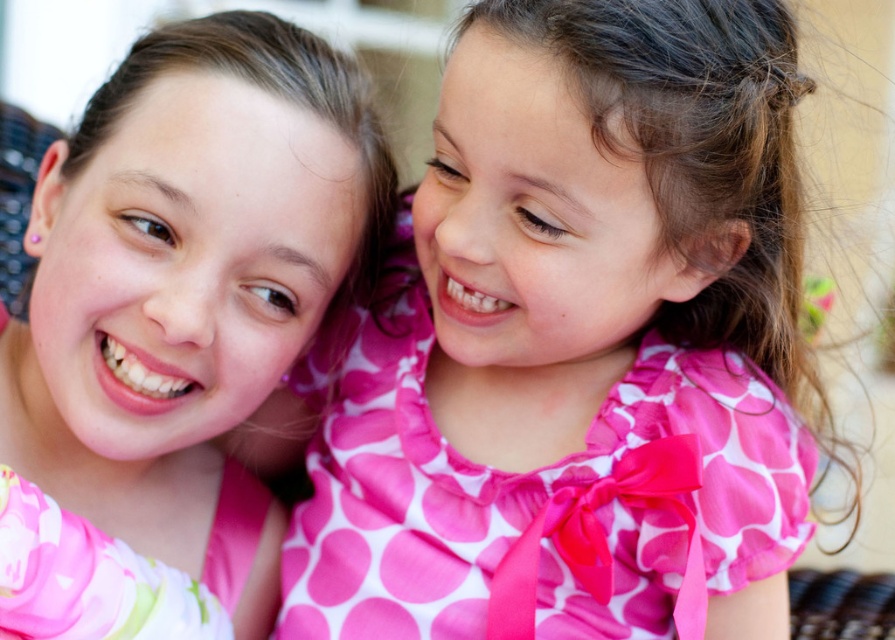
You are a fashion designer observing two pink items in the image. The first is the pink polka dot dress at center, and the second is the pink fabric at upper left. Which of these two items is shorter in height?

The pink polka dot dress at center is shorter than the pink fabric at upper left.

You are a photographer trying to capture a closeup of the pink polka dot dress at center without the pink fabric at upper left appearing in the background. Based on the scene description, is this possible?

The pink fabric at upper left is behind the pink polka dot dress at center, so it will appear in the background. To avoid it, you need to adjust your angle or position so the dress is between you and the fabric.

In the scene shown: You are a photographer trying to capture a closeup of the pink polka dot dress at center. Based on the scene description, can you determine if the dress is within the optimal focus range of your camera, which requires subjects to be between 24 and 36 inches away?

The pink polka dot dress at center is 23.94 inches away from camera, which is just below the minimum required distance of 24 inches. Therefore, the dress is slightly out of the optimal focus range.